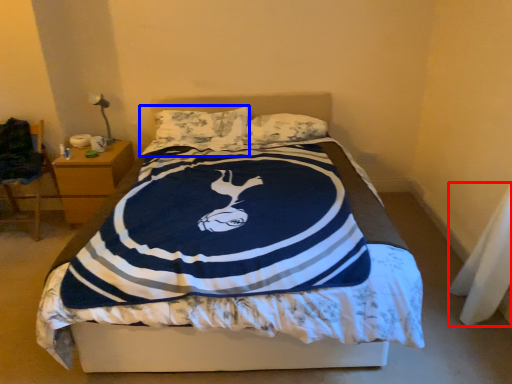
Question: Which object appears farthest to the camera in this image, material (highlighted by a red box) or pillow (highlighted by a blue box)?

Choices:
 (A) material
 (B) pillow

Answer: (B)